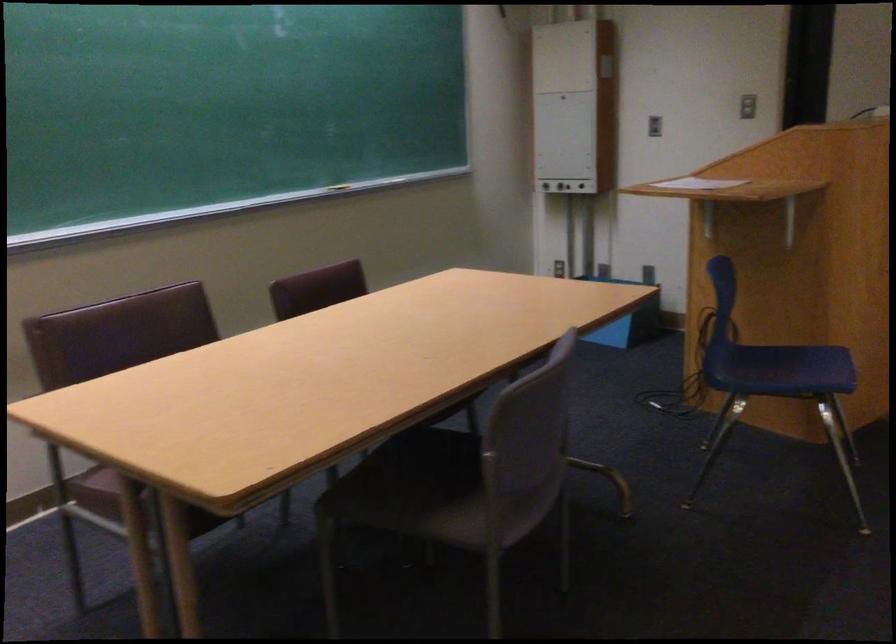
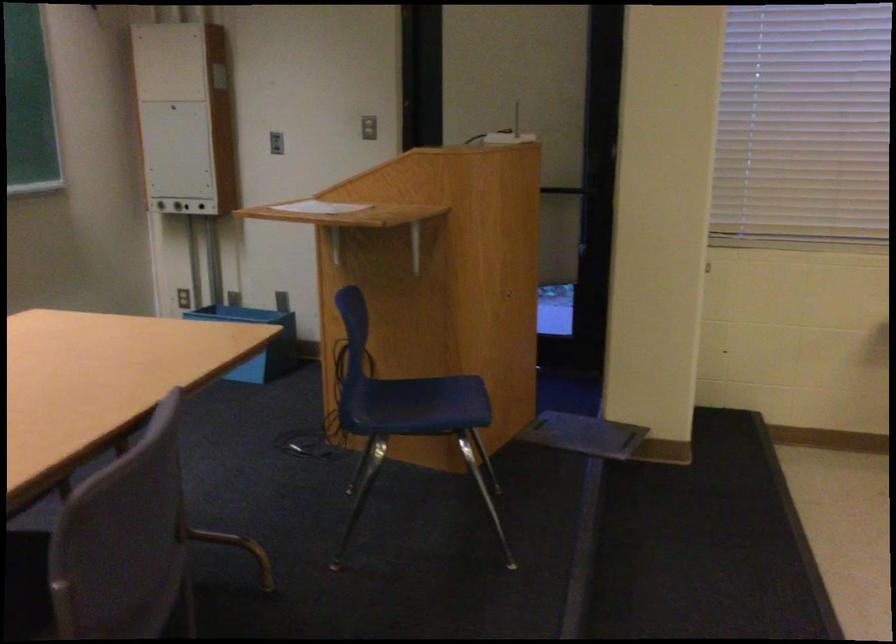
In the second image, find the point that corresponds to pixel 788 362 in the first image.

(424, 398)